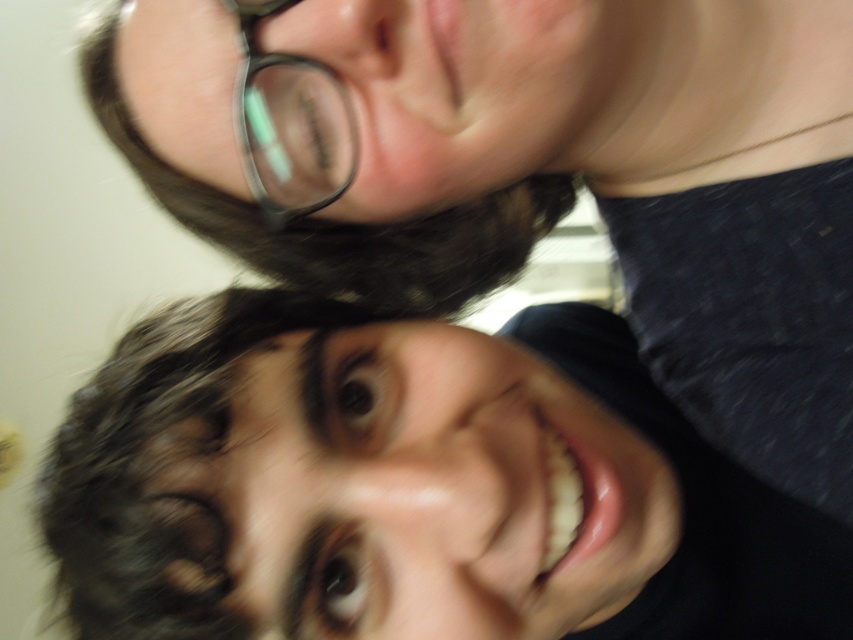
Question: Is dark brown hair at lower left to the right of black plastic glasses at upper center from the viewer's perspective?

Choices:
 (A) yes
 (B) no

Answer: (A)

Question: Which point appears farthest from the camera in this image?

Choices:
 (A) tap(294, 376)
 (B) tap(245, 1)

Answer: (A)

Question: Which object appears farthest from the camera in this image?

Choices:
 (A) dark brown hair at lower left
 (B) black plastic glasses at upper center

Answer: (A)

Question: Does dark brown hair at lower left appear under black plastic glasses at upper center?

Choices:
 (A) yes
 (B) no

Answer: (A)

Question: Does dark brown hair at lower left come in front of black plastic glasses at upper center?

Choices:
 (A) yes
 (B) no

Answer: (B)